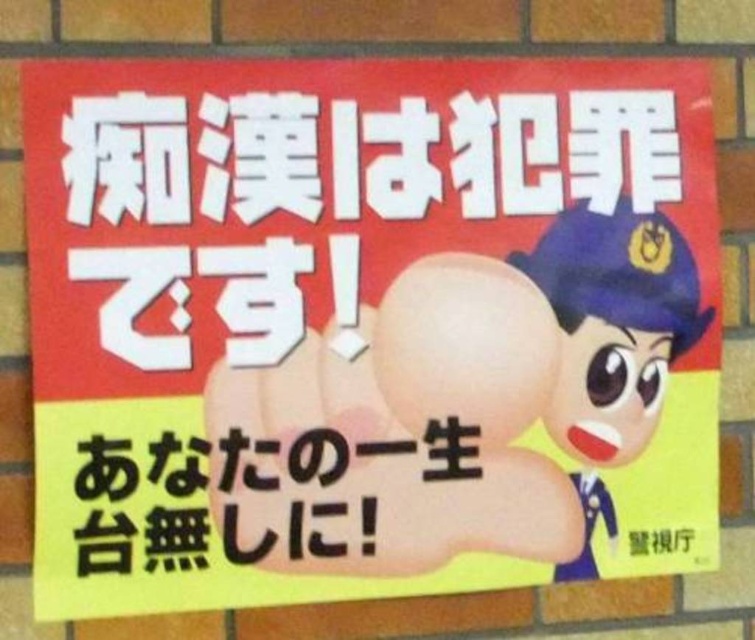
Question: Among these points, which one is nearest to the camera?

Choices:
 (A) (599, 404)
 (B) (202, 449)

Answer: (B)

Question: Which point is farther from the camera taking this photo?

Choices:
 (A) (596, 432)
 (B) (371, 444)

Answer: (A)

Question: Does shiny blue uniform at right have a greater width compared to black paper at lower center?

Choices:
 (A) yes
 (B) no

Answer: (B)

Question: Can you confirm if shiny blue uniform at right is positioned to the right of black paper at lower center?

Choices:
 (A) yes
 (B) no

Answer: (A)

Question: Is shiny blue uniform at right to the right of black paper at lower center from the viewer's perspective?

Choices:
 (A) yes
 (B) no

Answer: (A)